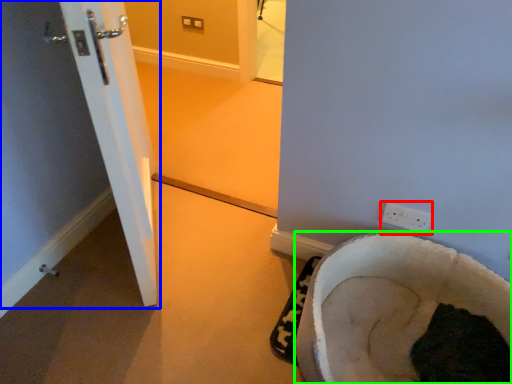
Question: Which is farther away from electric outlet (highlighted by a red box)? door (highlighted by a blue box) or furniture (highlighted by a green box)?

Choices:
 (A) door
 (B) furniture

Answer: (A)